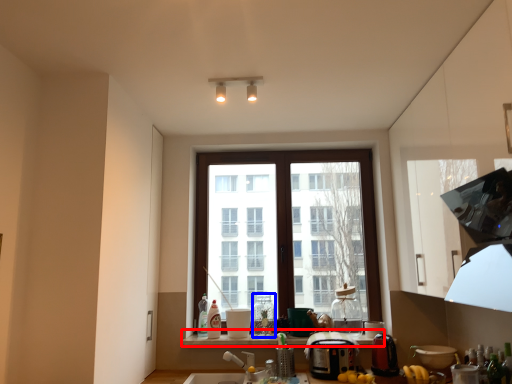
Question: Which object is closer to the camera taking this photo, window sill (highlighted by a red box) or bottle (highlighted by a blue box)?

Choices:
 (A) window sill
 (B) bottle

Answer: (A)